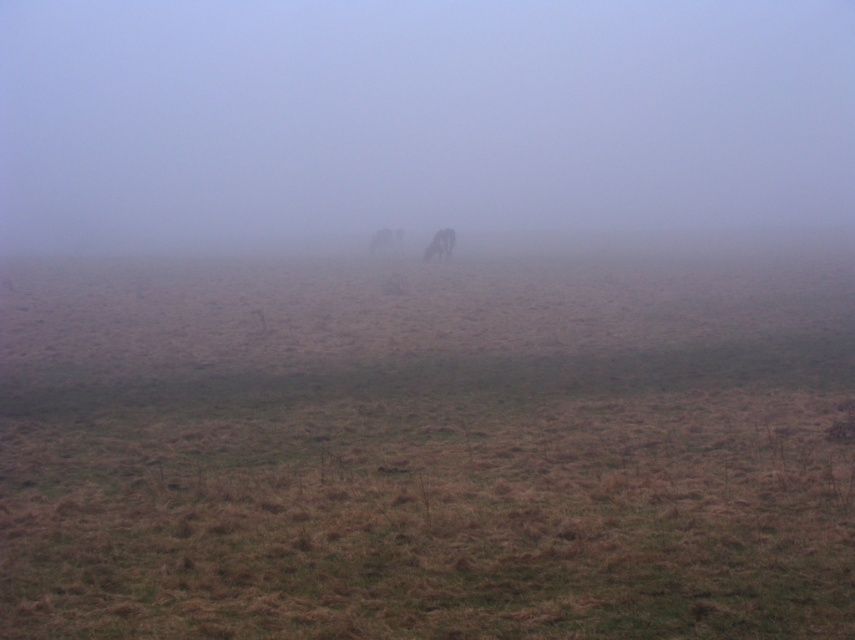
You are a hiker trying to locate your lost dog in the foggy field. You see two brown figures at center, a brown furry dog at center and a brown fur horse at center. Which one is positioned higher and thus more visible above the other?

The brown furry dog at center is above brown fur horse at center, so the dog is higher and more visible.

You are a hiker trying to navigate through the foggy atmosphere at center and the brown fur horse at center. Which one is taller?

The foggy atmosphere at center is much taller than the brown fur horse at center.

You are a hiker trying to identify two animals in the foggy landscape. You see a brown furry dog at center and a brown fur horse at center. Which one is larger?

The brown furry dog at center is bigger than the brown fur horse at center.